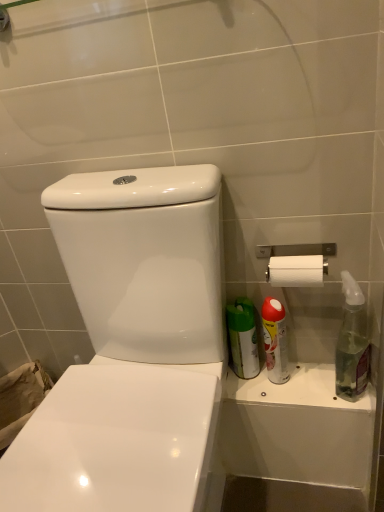
How much space does clear glass spray bottle at right, positioned as the 1th cleaning product in right-to-left order, occupy horizontally?

The width of clear glass spray bottle at right, positioned as the 1th cleaning product in right-to-left order, is 4.41 inches.

At what (x,y) coordinates should I click in order to perform the action: click on red matte spray can at right, positioned as the first cleaning product in left-to-right order. Please return your answer as a coordinate pair (x, y). Looking at the image, I should click on (275, 340).

Between point (124, 505) and point (270, 358), which one is positioned behind?

Positioned behind is point (270, 358).

Between white glossy toilet at center and red matte spray can at right, positioned as the first cleaning product in left-to-right order, which one appears on the left side from the viewer's perspective?

Positioned to the left is white glossy toilet at center.

Considering the sizes of objects white glossy toilet at center and red matte spray can at right, the second cleaning product in the right-to-left sequence, in the image provided, who is shorter, white glossy toilet at center or red matte spray can at right, the second cleaning product in the right-to-left sequence,?

Standing shorter between the two is red matte spray can at right, the second cleaning product in the right-to-left sequence.

Looking at this image, how different are the orientations of white glossy toilet at center and red matte spray can at right, the second cleaning product in the right-to-left sequence, in degrees?

The angular difference between white glossy toilet at center and red matte spray can at right, the second cleaning product in the right-to-left sequence, is 0.288 degrees.

Is silver metallic toilet paper holder at upper right facing towards red matte spray can at right, positioned as the first cleaning product in left-to-right order?

No, silver metallic toilet paper holder at upper right is not facing towards red matte spray can at right, positioned as the first cleaning product in left-to-right order.

Is silver metallic toilet paper holder at upper right shorter than red matte spray can at right, positioned as the first cleaning product in left-to-right order?

Yes.

Is silver metallic toilet paper holder at upper right next to red matte spray can at right, the second cleaning product in the right-to-left sequence, and touching it?

No, silver metallic toilet paper holder at upper right is not beside red matte spray can at right, the second cleaning product in the right-to-left sequence.

What's the angular difference between silver metallic toilet paper holder at upper right and red matte spray can at right, positioned as the first cleaning product in left-to-right order,'s facing directions?

Result: 0.00343 degrees separate the facing orientations of silver metallic toilet paper holder at upper right and red matte spray can at right, positioned as the first cleaning product in left-to-right order.

Is red matte spray can at right, positioned as the first cleaning product in left-to-right order, bigger or smaller than clear glass spray bottle at right, positioned as the 1th cleaning product in right-to-left order?

red matte spray can at right, positioned as the first cleaning product in left-to-right order, is smaller than clear glass spray bottle at right, positioned as the 1th cleaning product in right-to-left order.

Does point (278, 319) appear closer or farther from the camera than point (351, 321)?

Point (278, 319).

From the image's perspective, does red matte spray can at right, positioned as the first cleaning product in left-to-right order, appear higher than clear glass spray bottle at right, positioned as the 1th cleaning product in right-to-left order?

No.

From a real-world perspective, is silver metallic toilet paper holder at upper right above or below clear glass spray bottle at right, positioned as the 1th cleaning product in right-to-left order?

In terms of real-world spatial position, silver metallic toilet paper holder at upper right is above clear glass spray bottle at right, positioned as the 1th cleaning product in right-to-left order.

Is silver metallic toilet paper holder at upper right facing away from clear glass spray bottle at right, positioned as the 1th cleaning product in right-to-left order?

No, silver metallic toilet paper holder at upper right is not facing the opposite direction of clear glass spray bottle at right, positioned as the 1th cleaning product in right-to-left order.

Can you tell me how much silver metallic toilet paper holder at upper right and clear glass spray bottle at right, positioned as the 1th cleaning product in right-to-left order, differ in facing direction?

They differ by 0.000547 degrees in their facing directions.

Where is `towel bar above the clear glass spray bottle at right, positioned as the 2th cleaning product in left-to-right order (from the image's perspective)`? The image size is (384, 512). towel bar above the clear glass spray bottle at right, positioned as the 2th cleaning product in left-to-right order (from the image's perspective) is located at coordinates (296, 264).

Is clear glass spray bottle at right, positioned as the 2th cleaning product in left-to-right order, oriented away from silver metallic toilet paper holder at upper right?

That's not correct — clear glass spray bottle at right, positioned as the 2th cleaning product in left-to-right order, is not looking away from silver metallic toilet paper holder at upper right.

Is point (336, 386) positioned after point (332, 245)?

Yes, point (336, 386) is farther from viewer.

You are a GUI agent. You are given a task and a screenshot of the screen. Output one action in this format:
    pyautogui.click(x=<x>, y=<y>)
    Task: Click on the cleaning product on the right of silver metallic toilet paper holder at upper right
    This screenshot has width=384, height=512.
    Given the screenshot: What is the action you would take?
    pyautogui.click(x=352, y=342)

From a real-world perspective, is clear glass spray bottle at right, positioned as the 1th cleaning product in right-to-left order, physically located above or below silver metallic toilet paper holder at upper right?

Clearly, from a real-world perspective, clear glass spray bottle at right, positioned as the 1th cleaning product in right-to-left order, is below silver metallic toilet paper holder at upper right.

Is white glossy toilet at center positioned behind clear glass spray bottle at right, positioned as the 1th cleaning product in right-to-left order?

No, white glossy toilet at center is closer to the camera.

Locate an element on the screen. The width and height of the screenshot is (384, 512). cleaning product positioned vertically above the white glossy toilet at center (from a real-world perspective) is located at coordinates (352, 342).

How different are the orientations of white glossy toilet at center and clear glass spray bottle at right, positioned as the 2th cleaning product in left-to-right order, in degrees?

There is a 0.288-degree angle between the facing directions of white glossy toilet at center and clear glass spray bottle at right, positioned as the 2th cleaning product in left-to-right order.

From a real-world perspective, who is located lower, white glossy toilet at center or clear glass spray bottle at right, positioned as the 1th cleaning product in right-to-left order?

white glossy toilet at center is physically lower.

Which of these two, clear glass spray bottle at right, positioned as the 1th cleaning product in right-to-left order, or red matte spray can at right, the second cleaning product in the right-to-left sequence, stands shorter?

With less height is red matte spray can at right, the second cleaning product in the right-to-left sequence.

Considering the points (366, 384) and (279, 301), which point is in front, point (366, 384) or point (279, 301)?

Point (366, 384)

Is clear glass spray bottle at right, positioned as the 1th cleaning product in right-to-left order, positioned in front of red matte spray can at right, positioned as the first cleaning product in left-to-right order?

Yes, clear glass spray bottle at right, positioned as the 1th cleaning product in right-to-left order, is closer to the viewer.

Measure the distance from clear glass spray bottle at right, positioned as the 1th cleaning product in right-to-left order, to red matte spray can at right, positioned as the first cleaning product in left-to-right order.

clear glass spray bottle at right, positioned as the 1th cleaning product in right-to-left order, and red matte spray can at right, positioned as the first cleaning product in left-to-right order, are 6.14 inches apart from each other.

Image resolution: width=384 pixels, height=512 pixels. I want to click on cleaning product that is the 2nd object located behind the white glossy toilet at center, so click(275, 340).

Identify the location of towel bar that appears above the red matte spray can at right, positioned as the first cleaning product in left-to-right order (from the image's perspective). (296, 264).

From the image, which object appears to be farther from white glossy toilet at center, silver metallic toilet paper holder at upper right or clear glass spray bottle at right, positioned as the 1th cleaning product in right-to-left order?

clear glass spray bottle at right, positioned as the 1th cleaning product in right-to-left order, lies further to white glossy toilet at center than the other object.

Based on the photo, estimate the real-world distances between objects in this image. Which object is further from red matte spray can at right, the second cleaning product in the right-to-left sequence, white glossy toilet at center or silver metallic toilet paper holder at upper right?

Based on the image, white glossy toilet at center appears to be further to red matte spray can at right, the second cleaning product in the right-to-left sequence.

When comparing their distances from clear glass spray bottle at right, positioned as the 2th cleaning product in left-to-right order, does silver metallic toilet paper holder at upper right or red matte spray can at right, positioned as the first cleaning product in left-to-right order, seem further?

The object further to clear glass spray bottle at right, positioned as the 2th cleaning product in left-to-right order, is red matte spray can at right, positioned as the first cleaning product in left-to-right order.

Considering their positions, is red matte spray can at right, the second cleaning product in the right-to-left sequence, positioned closer to silver metallic toilet paper holder at upper right than clear glass spray bottle at right, positioned as the 2th cleaning product in left-to-right order?

red matte spray can at right, the second cleaning product in the right-to-left sequence, is closer to silver metallic toilet paper holder at upper right.

Based on their spatial positions, is silver metallic toilet paper holder at upper right or white glossy toilet at center closer to red matte spray can at right, the second cleaning product in the right-to-left sequence?

Based on the image, silver metallic toilet paper holder at upper right appears to be nearer to red matte spray can at right, the second cleaning product in the right-to-left sequence.

Which object lies nearer to the anchor point silver metallic toilet paper holder at upper right, red matte spray can at right, the second cleaning product in the right-to-left sequence, or white glossy toilet at center?

red matte spray can at right, the second cleaning product in the right-to-left sequence.

Based on their spatial positions, is clear glass spray bottle at right, positioned as the 1th cleaning product in right-to-left order, or white glossy toilet at center closer to red matte spray can at right, positioned as the first cleaning product in left-to-right order?

The object closer to red matte spray can at right, positioned as the first cleaning product in left-to-right order, is clear glass spray bottle at right, positioned as the 1th cleaning product in right-to-left order.

Considering their positions, is red matte spray can at right, the second cleaning product in the right-to-left sequence, positioned closer to clear glass spray bottle at right, positioned as the 2th cleaning product in left-to-right order, than silver metallic toilet paper holder at upper right?

silver metallic toilet paper holder at upper right.

I want to click on cleaning product located between white glossy toilet at center and red matte spray can at right, positioned as the first cleaning product in left-to-right order, in the depth direction, so click(352, 342).

The width and height of the screenshot is (384, 512). Identify the location of towel bar located between white glossy toilet at center and clear glass spray bottle at right, positioned as the 1th cleaning product in right-to-left order, in the depth direction. (296, 264).

Where is `cleaning product that lies between silver metallic toilet paper holder at upper right and red matte spray can at right, positioned as the first cleaning product in left-to-right order, from top to bottom`? The width and height of the screenshot is (384, 512). cleaning product that lies between silver metallic toilet paper holder at upper right and red matte spray can at right, positioned as the first cleaning product in left-to-right order, from top to bottom is located at coordinates (352, 342).

What are the coordinates of `towel bar positioned between white glossy toilet at center and red matte spray can at right, the second cleaning product in the right-to-left sequence, from near to far` in the screenshot? It's located at (296, 264).